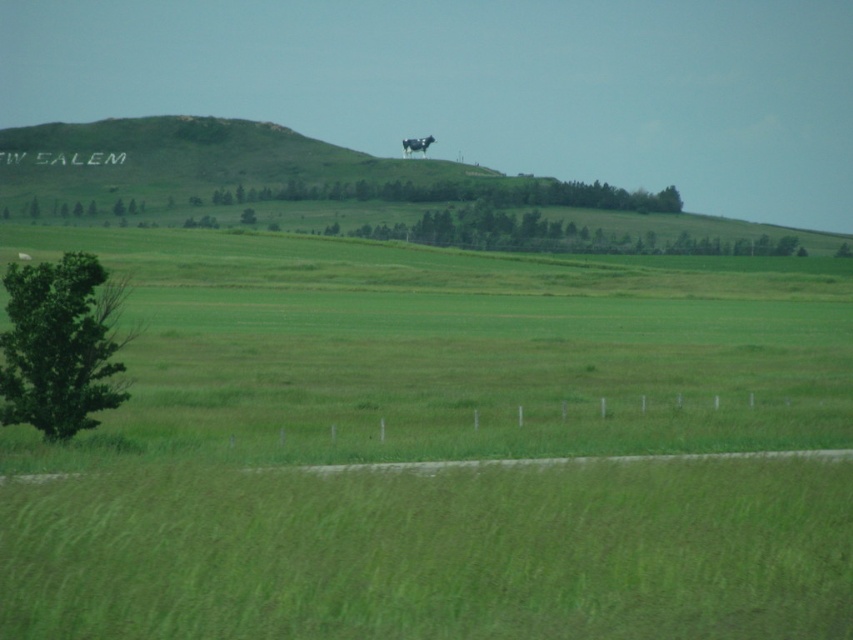
Is point (160, 122) positioned before point (51, 436)?

No, it is not.

Which is more to the left, green grassy hillside at upper center or green leafy tree at lower left?

From the viewer's perspective, green grassy hillside at upper center appears more on the left side.

Locate an element on the screen. This screenshot has height=640, width=853. green grassy hillside at upper center is located at coordinates (195, 157).